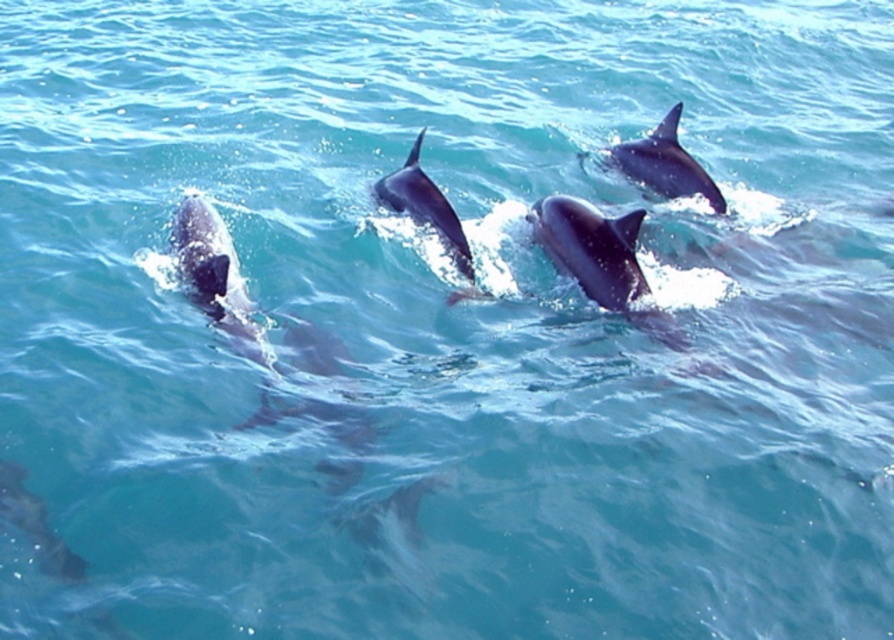
Question: Considering the relative positions of smooth gray dolphin at center and glossy blue dolphin at upper right in the image provided, where is smooth gray dolphin at center located with respect to glossy blue dolphin at upper right?

Choices:
 (A) above
 (B) below

Answer: (B)

Question: Which is nearer to the smooth gray dolphin at lower left?

Choices:
 (A) glossy blue dolphin at upper right
 (B) smooth gray dolphin at left
 (C) smooth gray dolphin at center

Answer: (B)

Question: Is smooth gray dolphin at left closer to the viewer compared to smooth gray dolphin at lower left?

Choices:
 (A) yes
 (B) no

Answer: (B)

Question: Does smooth gray dolphin at center appear under glossy blue dolphin at upper right?

Choices:
 (A) no
 (B) yes

Answer: (B)

Question: Which of the following is the farthest from the observer?

Choices:
 (A) (635, 145)
 (B) (467, 252)
 (C) (197, 234)
 (D) (633, 248)

Answer: (A)

Question: Which object is farther from the camera taking this photo?

Choices:
 (A) glossy blue dolphin at upper right
 (B) smooth gray dolphin at left
 (C) smooth gray dolphin at lower left

Answer: (A)